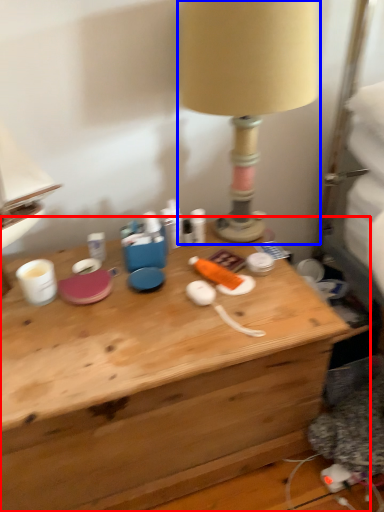
Question: Which point is further to the camera, desk (highlighted by a red box) or lamp (highlighted by a blue box)?

Choices:
 (A) desk
 (B) lamp

Answer: (B)